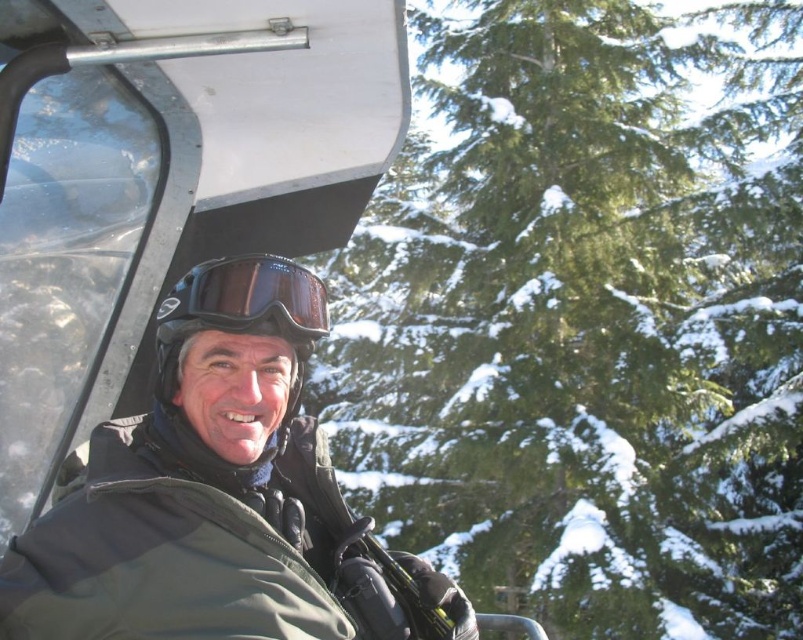
Question: In this image, where is green textured pine at upper center located relative to matte black goggles at center?

Choices:
 (A) right
 (B) left

Answer: (A)

Question: Does green textured pine at upper center come in front of matte black goggles at center?

Choices:
 (A) no
 (B) yes

Answer: (A)

Question: Which object appears farthest from the camera in this image?

Choices:
 (A) green textured pine at upper center
 (B) matte black goggles at center

Answer: (A)

Question: Which point is closer to the camera taking this photo?

Choices:
 (A) (306, 340)
 (B) (435, 502)

Answer: (A)

Question: Does green textured pine at upper center have a greater width compared to matte black goggles at center?

Choices:
 (A) yes
 (B) no

Answer: (A)